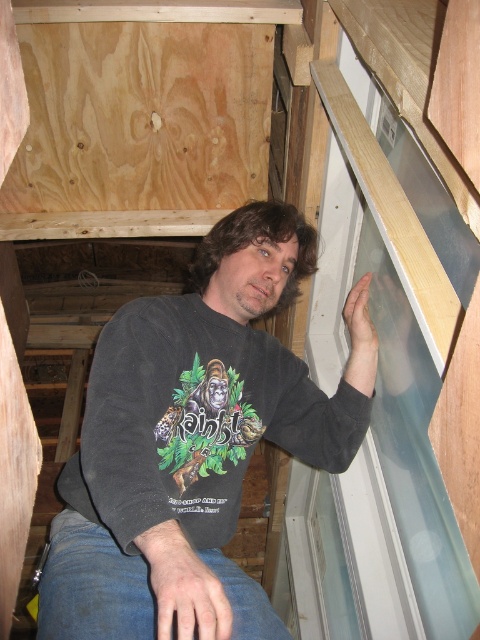
Which is more to the left, transparent glass window at upper center or dark gray sweatshirt at center?

Positioned to the left is dark gray sweatshirt at center.

The width and height of the screenshot is (480, 640). What do you see at coordinates (384, 346) in the screenshot?
I see `transparent glass window at upper center` at bounding box center [384, 346].

Locate an element on the screen. This screenshot has height=640, width=480. transparent glass window at upper center is located at coordinates (384, 346).

Find the location of a particular element. The height and width of the screenshot is (640, 480). transparent glass window at upper center is located at coordinates (384, 346).